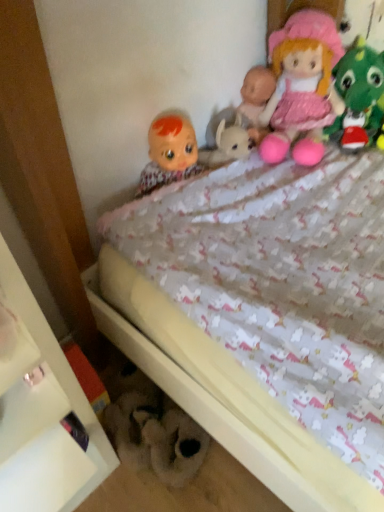
Question: Is fluffy white teddy bear at lower center, the first toy ordered from the bottom, taller than matte plastic doll at upper left, the first doll in the left-to-right sequence?

Choices:
 (A) no
 (B) yes

Answer: (A)

Question: Is fluffy white teddy bear at lower center, the 2th toy from the right, further to camera compared to matte plastic doll at upper left, the first doll in the left-to-right sequence?

Choices:
 (A) yes
 (B) no

Answer: (B)

Question: Is fluffy white teddy bear at lower center, the second toy positioned from the top, looking in the opposite direction of matte plastic doll at upper left, the first doll in the left-to-right sequence?

Choices:
 (A) no
 (B) yes

Answer: (A)

Question: Is fluffy white teddy bear at lower center, the 2th toy from the right, surrounding matte plastic doll at upper left, the 2th doll viewed from the right?

Choices:
 (A) yes
 (B) no

Answer: (B)

Question: From a real-world perspective, does fluffy white teddy bear at lower center, which ranks as the 1th toy in left-to-right order, sit lower than matte plastic doll at upper left, the 2th doll viewed from the right?

Choices:
 (A) no
 (B) yes

Answer: (B)

Question: Does fluffy white teddy bear at lower center, the first toy ordered from the bottom, have a smaller size compared to matte plastic doll at upper left, the first doll in the left-to-right sequence?

Choices:
 (A) yes
 (B) no

Answer: (A)

Question: Could you tell me if white glossy shelf at lower left is facing pink fabric doll at upper right, placed as the second doll when sorted from left to right?

Choices:
 (A) no
 (B) yes

Answer: (A)

Question: Considering the relative positions of white glossy shelf at lower left and pink fabric doll at upper right, placed as the second doll when sorted from left to right, in the image provided, is white glossy shelf at lower left to the left of pink fabric doll at upper right, placed as the second doll when sorted from left to right, from the viewer's perspective?

Choices:
 (A) yes
 (B) no

Answer: (A)

Question: Can you confirm if white glossy shelf at lower left is positioned to the right of pink fabric doll at upper right, placed as the second doll when sorted from left to right?

Choices:
 (A) yes
 (B) no

Answer: (B)

Question: From a real-world perspective, is white glossy shelf at lower left over pink fabric doll at upper right, placed as the second doll when sorted from left to right?

Choices:
 (A) no
 (B) yes

Answer: (A)

Question: Does white glossy shelf at lower left come behind pink fabric doll at upper right, which is counted as the 1th doll, starting from the right?

Choices:
 (A) no
 (B) yes

Answer: (A)

Question: From the image's perspective, would you say white glossy shelf at lower left is positioned over pink fabric doll at upper right, placed as the second doll when sorted from left to right?

Choices:
 (A) yes
 (B) no

Answer: (B)

Question: Is matte plastic doll at upper left, the 2th doll viewed from the right, further to the viewer compared to white glossy shelf at lower left?

Choices:
 (A) no
 (B) yes

Answer: (B)